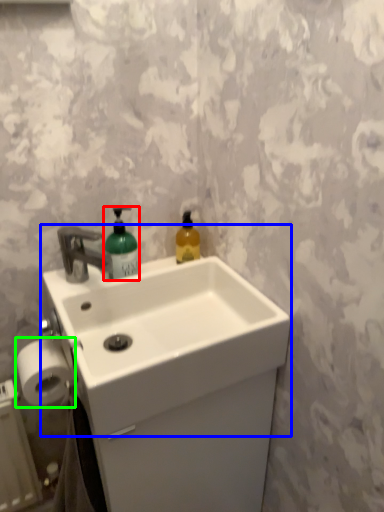
Question: Estimate the real-world distances between objects in this image. Which object is closer to bottle (highlighted by a red box), sink (highlighted by a blue box) or toilet paper (highlighted by a green box)?

Choices:
 (A) sink
 (B) toilet paper

Answer: (A)